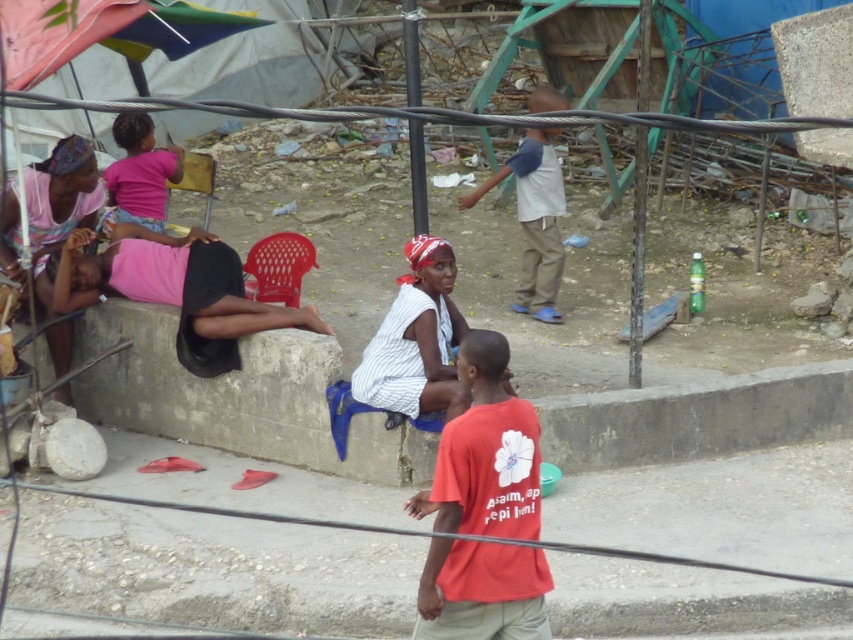
You are a photographer trying to capture a detailed shot of the white striped dress at center and the light blue denim pants at center. Which one should you focus on first to ensure it appears sharp in your photo?

The white striped dress at center is closer to the viewer than the light blue denim pants at center, so you should focus on the white striped dress at center first to ensure it appears sharp.

You are an observer standing in front of the scene. You notice two items of clothing in the image. The first is the red cotton shirt at center, and the second is the pink fabric at upper left. Which clothing item is positioned to the right of the other?

The red cotton shirt at center is to the right of the pink fabric at upper left.